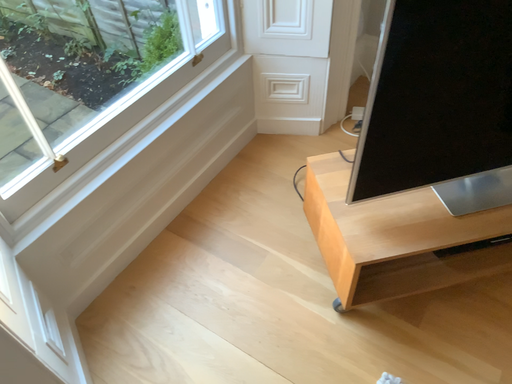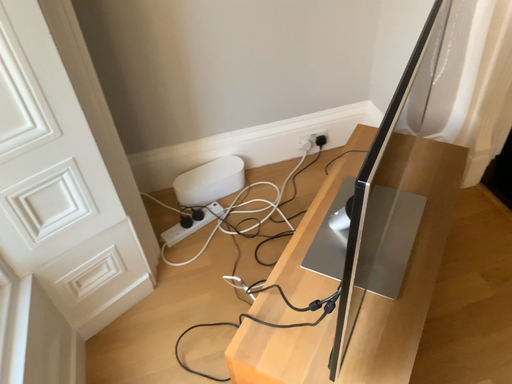
Question: How did the camera likely rotate when shooting the video?

Choices:
 (A) rotated downward
 (B) rotated upward

Answer: (B)